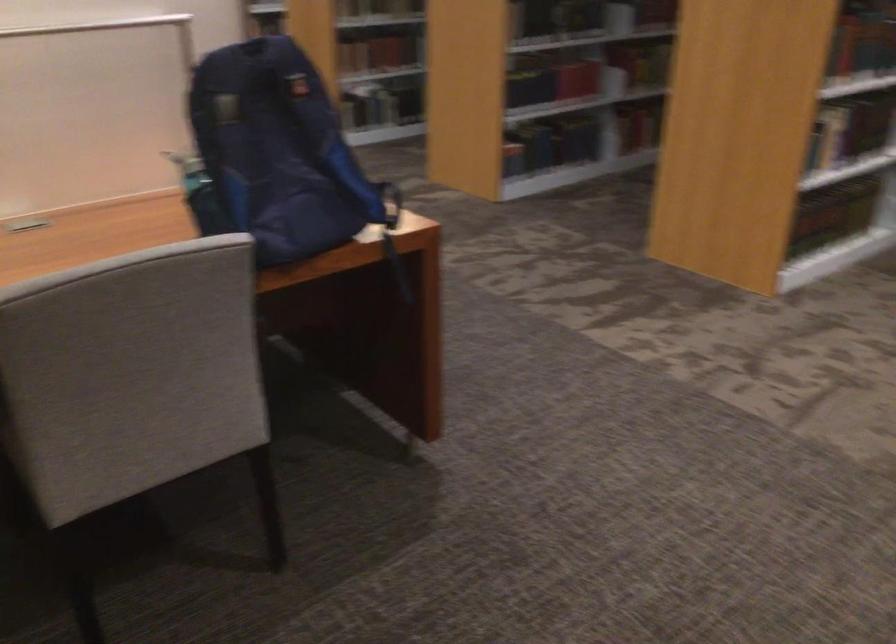
Find where to pull the blue backpack strap. Please return your answer as a coordinate pair (x, y).

(392, 234)